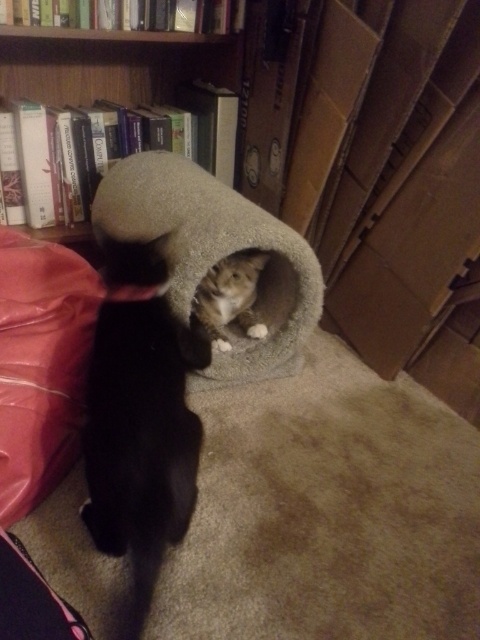
Does soft gray carpeted cat bed at center have a greater height compared to wooden bookshelf at upper left?

Correct, soft gray carpeted cat bed at center is much taller as wooden bookshelf at upper left.

Who is higher up, soft gray carpeted cat bed at center or wooden bookshelf at upper left?

wooden bookshelf at upper left is higher up.

Locate an element on the screen. soft gray carpeted cat bed at center is located at coordinates point(215,257).

Can you confirm if fluffy gray cat at center is thinner than tabby fur cat at center?

In fact, fluffy gray cat at center might be wider than tabby fur cat at center.

Is fluffy gray cat at center closer to the viewer compared to tabby fur cat at center?

That is True.

Locate an element on the screen. fluffy gray cat at center is located at coordinates (137, 422).

Where is `fluffy gray cat at center`? The width and height of the screenshot is (480, 640). fluffy gray cat at center is located at coordinates (137, 422).

Is the position of fluffy gray cat at center less distant than that of velvet pink pillow at lower left?

Yes, fluffy gray cat at center is in front of velvet pink pillow at lower left.

Which is in front, point (159, 483) or point (36, 260)?

Point (159, 483) is in front.

This screenshot has width=480, height=640. Find the location of `fluffy gray cat at center`. fluffy gray cat at center is located at coordinates (137, 422).